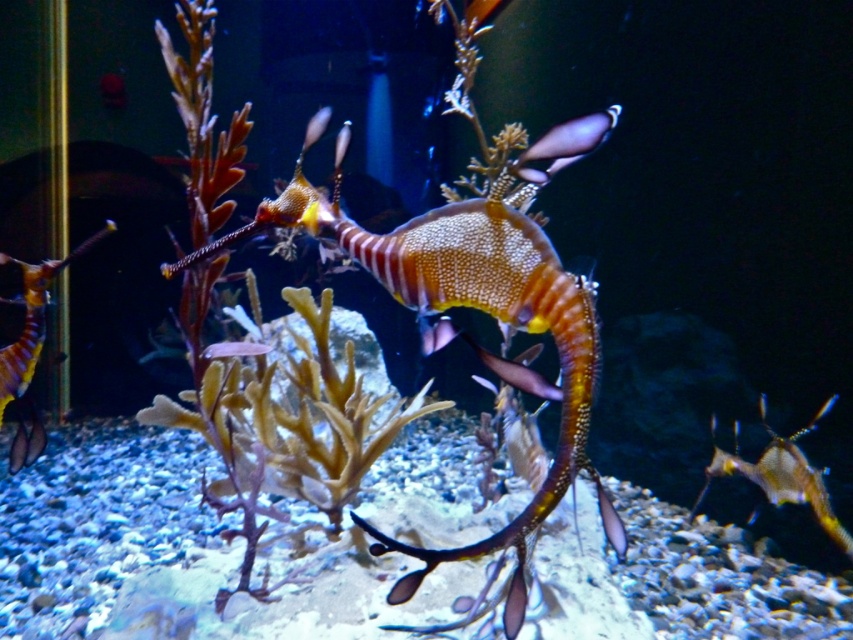
You are an underwater explorer observing the scene. You notice the shiny orange seahorse at left and the shiny purple fish at upper center. Which of these two creatures is positioned more to the left side of the image?

The shiny orange seahorse at left is positioned more to the left side of the image compared to the shiny purple fish at upper center.

You are a marine biologist observing the underwater scene. You notice the shiny orange seahorse at left and a brownish rock formation in the foreground. How far apart are these two objects?

A: The shiny orange seahorse at left and the brownish rock formation are 1.62 meters apart.

You are an underwater explorer observing the scene. You notice the shiny metallic seahorse at center and the shiny purple fish at upper center. Which one is positioned higher in the water?

The shiny purple fish at upper center is positioned higher in the water than the shiny metallic seahorse at center.